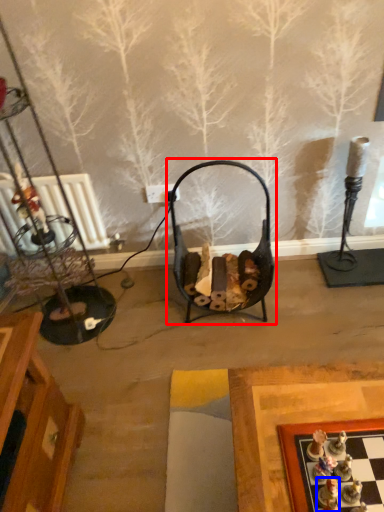
Question: Which object appears closest to the camera in this image, swivel chair (highlighted by a red box) or toy (highlighted by a blue box)?

Choices:
 (A) swivel chair
 (B) toy

Answer: (B)